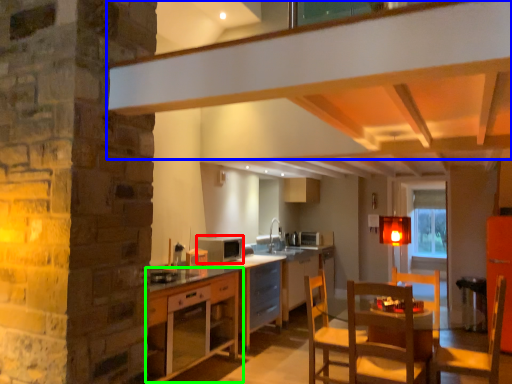
Question: Estimate the real-world distances between objects in this image. Which object is farther from appliance (highlighted by a red box), exhaust hood (highlighted by a blue box) or cabinetry (highlighted by a green box)?

Choices:
 (A) exhaust hood
 (B) cabinetry

Answer: (A)